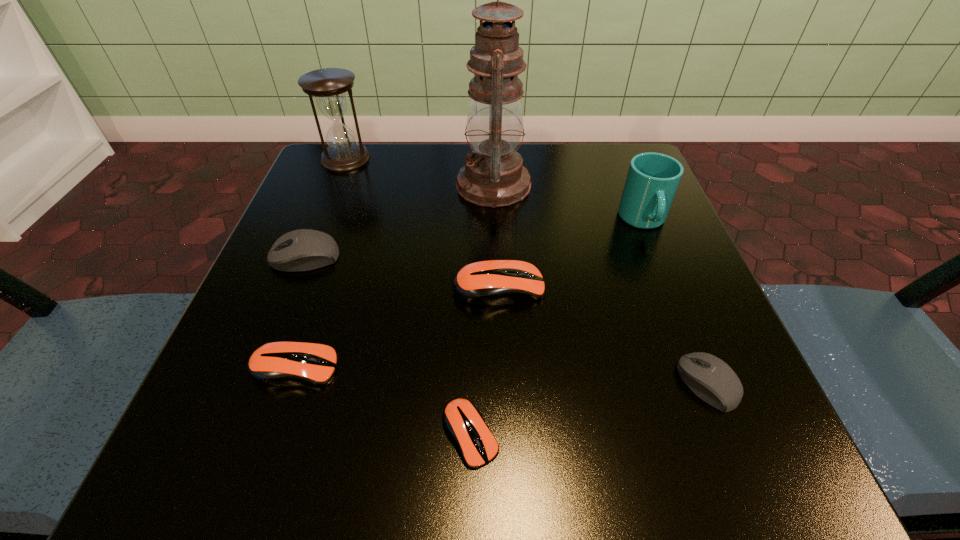
You are a GUI agent. You are given a task and a screenshot of the screen. Output one action in this format:
    pyautogui.click(x=<x>, y=<y>)
    Task: Click on the empty space between the leftmost orange computer mouse and the tallest object
    This screenshot has width=960, height=540.
    Given the screenshot: What is the action you would take?
    pyautogui.click(x=394, y=276)

Identify the location of free space between the tallest object and the shortest object. (482, 309).

Where is `vacant area that lies between the oil lamp and the rightmost computer mouse`? vacant area that lies between the oil lamp and the rightmost computer mouse is located at coordinates (601, 284).

Where is `object that is the fourth closest to the nearest orange computer mouse`? The width and height of the screenshot is (960, 540). object that is the fourth closest to the nearest orange computer mouse is located at coordinates (300, 250).

You are a GUI agent. You are given a task and a screenshot of the screen. Output one action in this format:
    pyautogui.click(x=<x>, y=<y>)
    Task: Click on the object that can be found as the seventh closest to the tallest object
    The height and width of the screenshot is (540, 960).
    Given the screenshot: What is the action you would take?
    pyautogui.click(x=462, y=419)

What are the coordinates of `computer mouse identified as the third closest to the shortest object` in the screenshot? It's located at (717, 384).

At what (x,y) coordinates should I click in order to perform the action: click on the closest computer mouse to the shortest object. Please return your answer as a coordinate pair (x, y). Looking at the image, I should click on (281, 363).

Locate which orange computer mouse is the second closest to the bigger black computer equipment. Please provide its 2D coordinates. Your answer should be formatted as a tuple, i.e. [(x, y)], where the tuple contains the x and y coordinates of a point satisfying the conditions above.

[(486, 283)]

Find the location of `orange computer mouse that is the second closest to the second biggest orange computer mouse`. orange computer mouse that is the second closest to the second biggest orange computer mouse is located at coordinates (486, 283).

Locate an element on the screen. Image resolution: width=960 pixels, height=540 pixels. vacant region that satisfies the following two spatial constraints: 1. on the front side of the farther black computer equipment; 2. on the left side of the second nearest orange computer mouse is located at coordinates (260, 368).